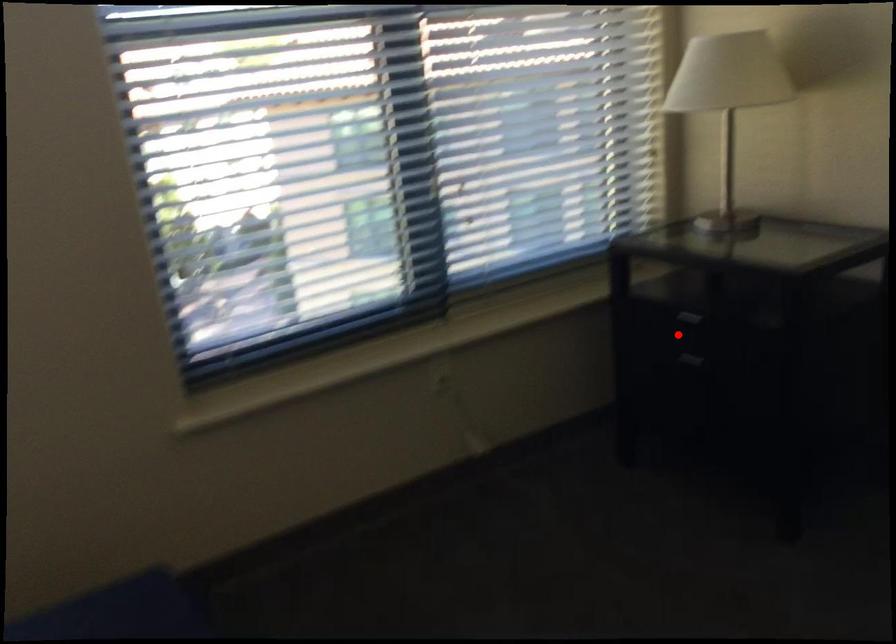
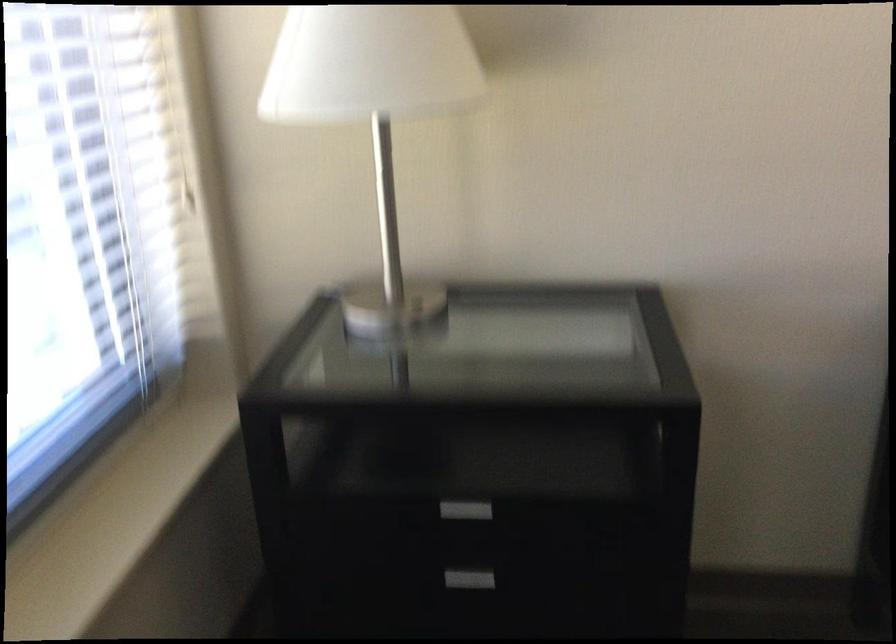
Question: A red point is marked in image1. In image2, is the corresponding 3D point closer to the camera or farther? Reply with the corresponding letter.

Choices:
 (A) The corresponding 3D point is closer.
 (B) The corresponding 3D point is farther.

Answer: (A)